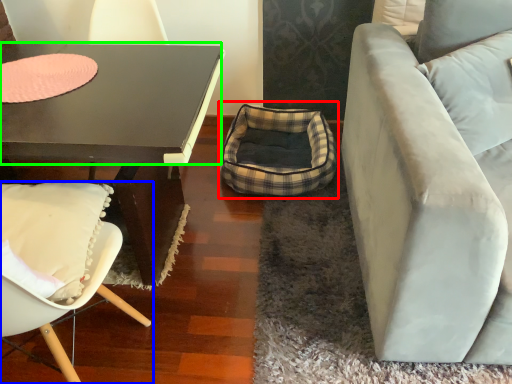
Question: Estimate the real-world distances between objects in this image. Which object is closer to bean bag chair (highlighted by a red box), chair (highlighted by a blue box) or glass table (highlighted by a green box)?

Choices:
 (A) chair
 (B) glass table

Answer: (B)